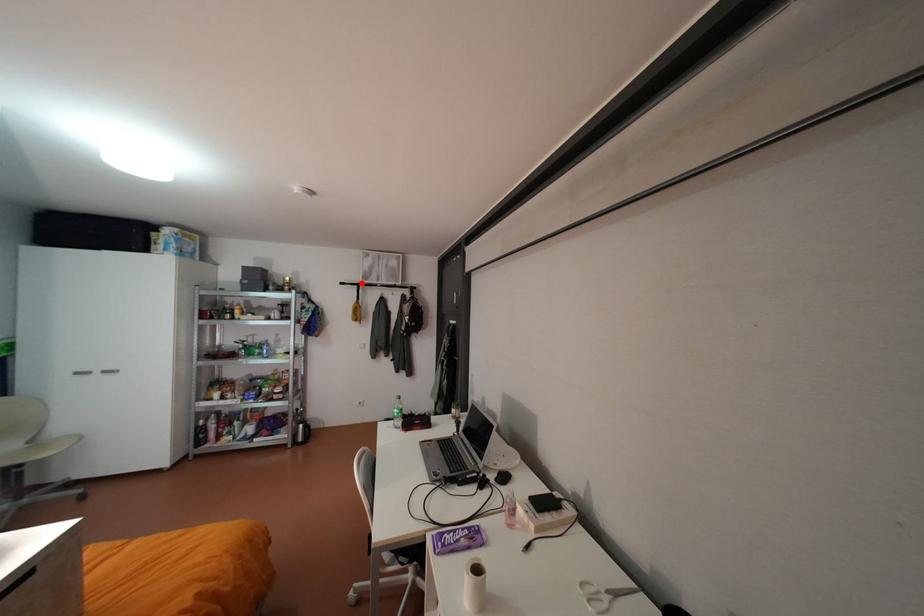
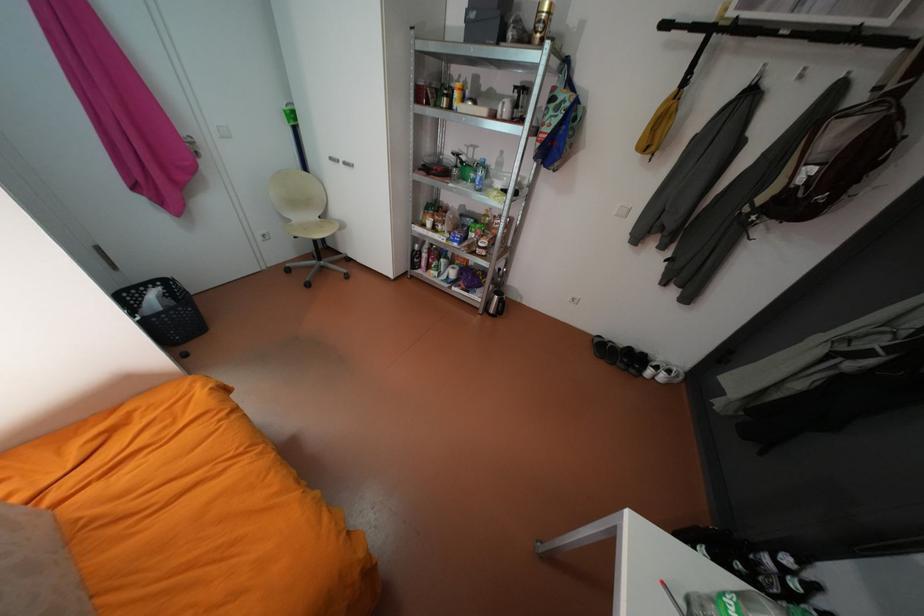
Find the pixel in the second image that matches the highlighted location in the first image.

(703, 26)